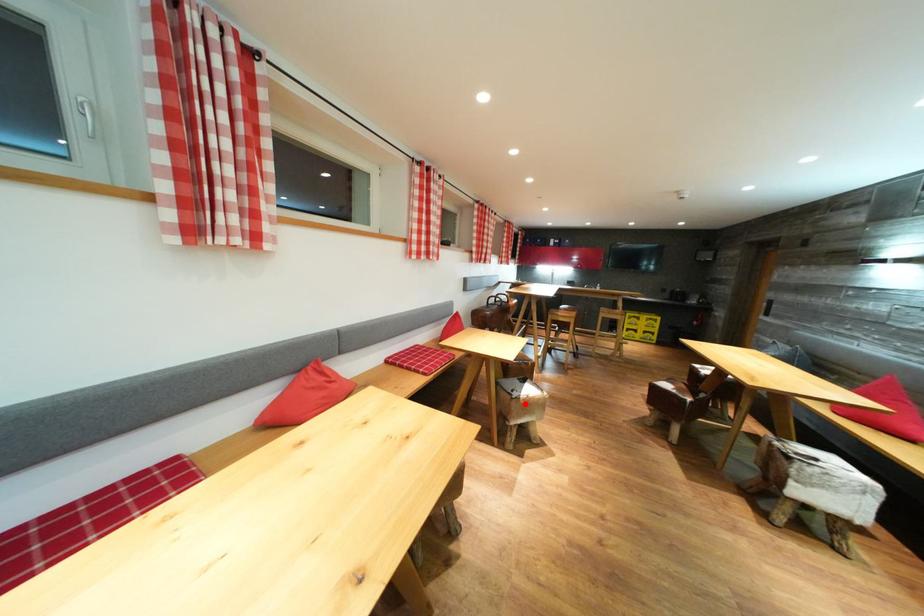
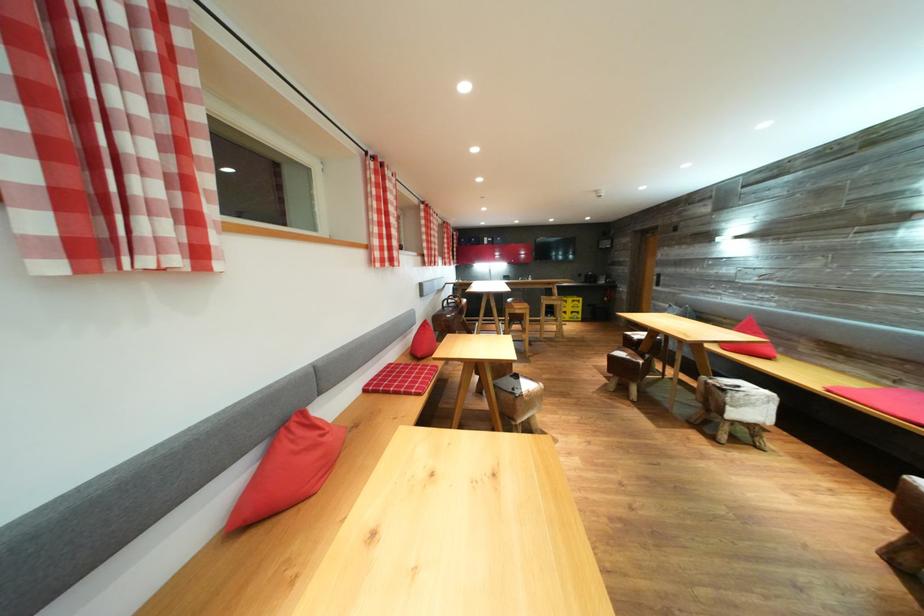
The point at the highlighted location is marked in the first image. Where is the corresponding point in the second image?

(528, 400)